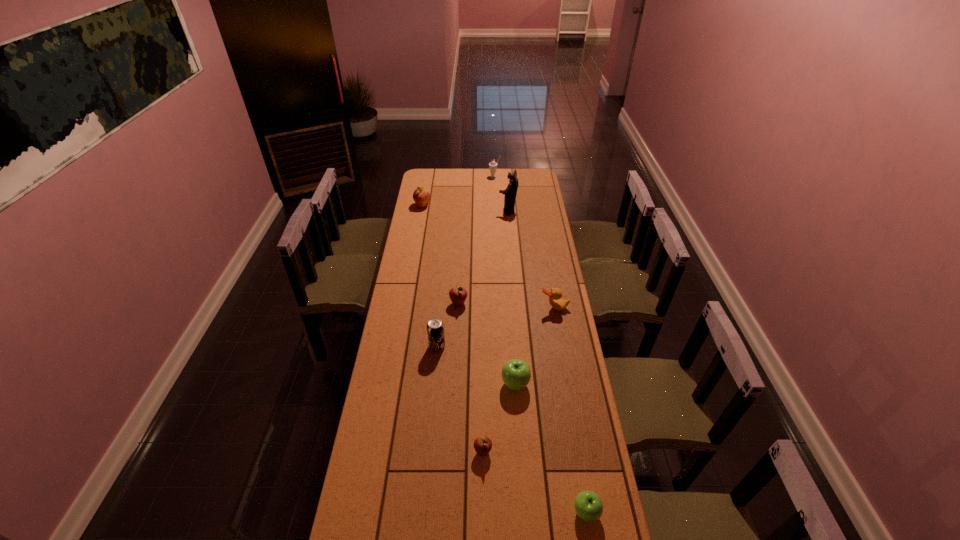
Identify the location of vacant space situated 0.130m on the front of the leftmost red apple. (420, 224).

Locate an element on the screen. This screenshot has width=960, height=540. vacant space located 0.150m on the front of the second object from left to right is located at coordinates (434, 383).

Locate an element on the screen. This screenshot has width=960, height=540. free spot located 0.310m on the right of the second red apple from right to left is located at coordinates (535, 303).

Find the location of `vacant space situated on the left of the bigger green apple`. vacant space situated on the left of the bigger green apple is located at coordinates point(486,384).

Where is `vacant space situated 0.130m on the beak of the tan duck`? This screenshot has height=540, width=960. vacant space situated 0.130m on the beak of the tan duck is located at coordinates (559, 335).

The height and width of the screenshot is (540, 960). Identify the location of vacant point located on the back of the fourth object from left to right. (483, 422).

Identify the location of free space located 0.230m on the back of the rightmost apple. (572, 430).

This screenshot has width=960, height=540. What are the coordinates of `object at the far edge` in the screenshot? It's located at (492, 165).

In order to click on object that is at the left edge in this screenshot , I will do `click(421, 196)`.

Identify the location of duck positioned at the right edge. (555, 294).